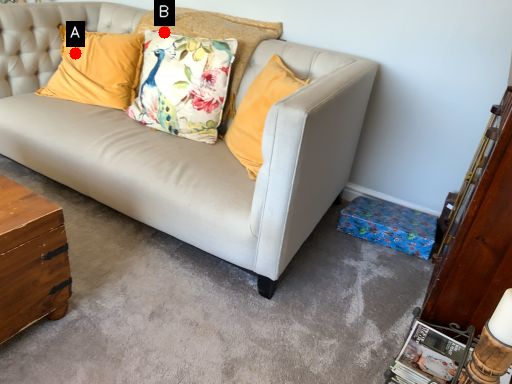
Question: Two points are circled on the image, labeled by A and B beside each circle. Which point is closer to the camera?

Choices:
 (A) A is closer
 (B) B is closer

Answer: (B)